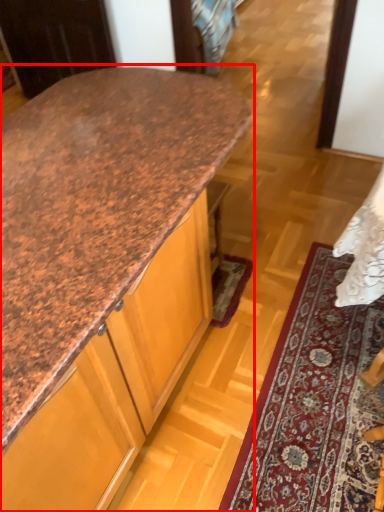
Question: Considering the relative positions of countertop (annotated by the red box) and mat in the image provided, where is countertop (annotated by the red box) located with respect to the staircase?

Choices:
 (A) right
 (B) left

Answer: (B)